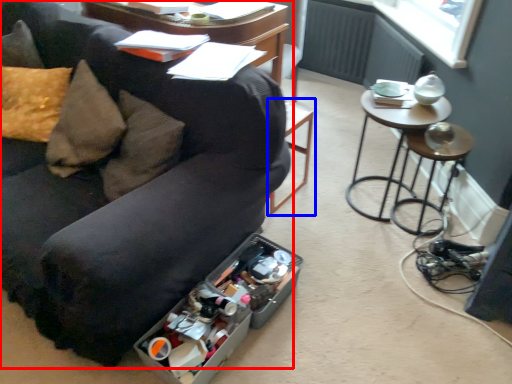
Question: Among these objects, which one is nearest to the camera, studio couch (highlighted by a red box) or bar stool (highlighted by a blue box)?

Choices:
 (A) studio couch
 (B) bar stool

Answer: (A)